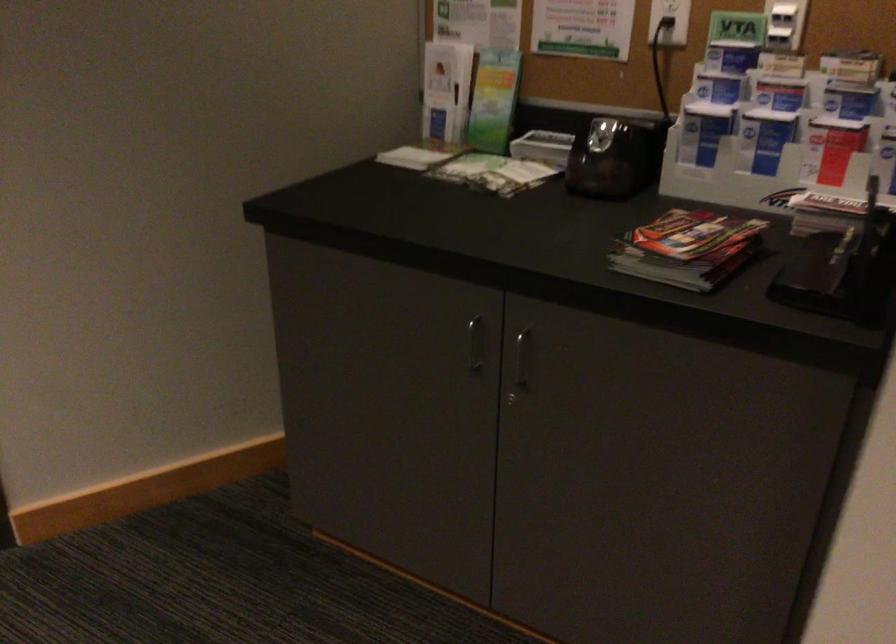
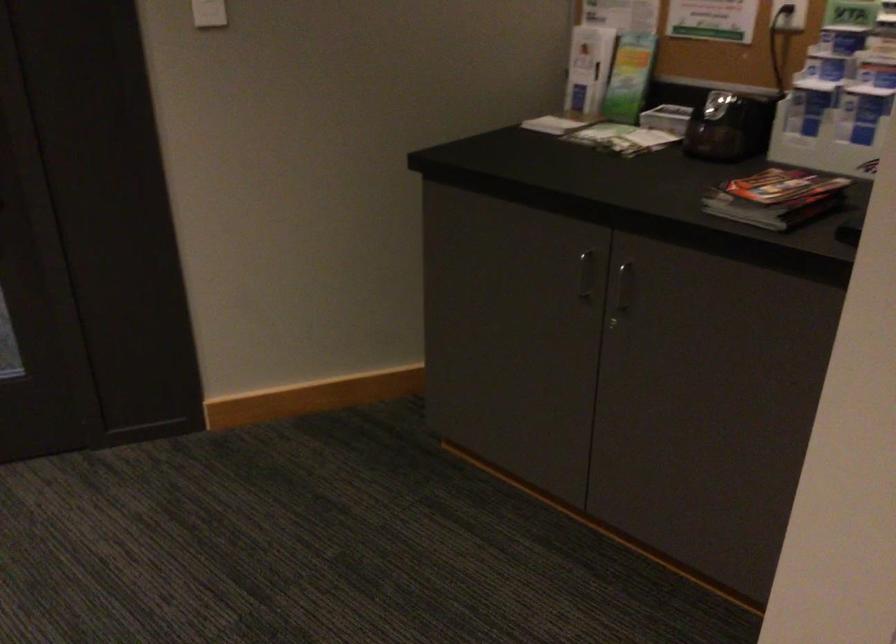
Question: What movement of the cameraman would produce the second image?

Choices:
 (A) Left
 (B) Right
 (C) Forward
 (D) Backward

Answer: (D)